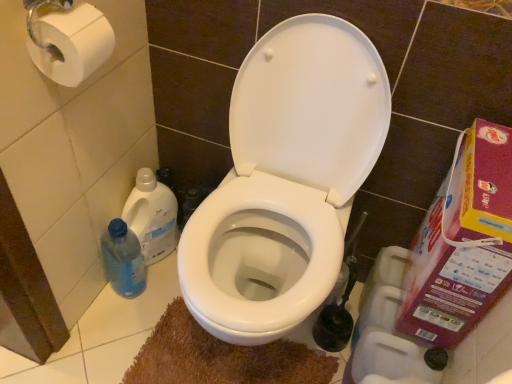
The image size is (512, 384). What are the coordinates of `vacant space that's between blue translucent bottle at left, which ranks as the first cleaning product in bottom-to-top order, and brown plush bath mat at lower center` in the screenshot? It's located at (139, 320).